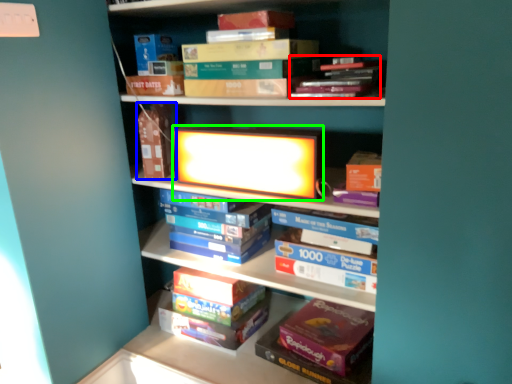
Question: Based on their relative distances, which object is farther from book (highlighted by a red box)? Choose from paperback book (highlighted by a blue box) and book cover (highlighted by a green box).

Choices:
 (A) paperback book
 (B) book cover

Answer: (A)